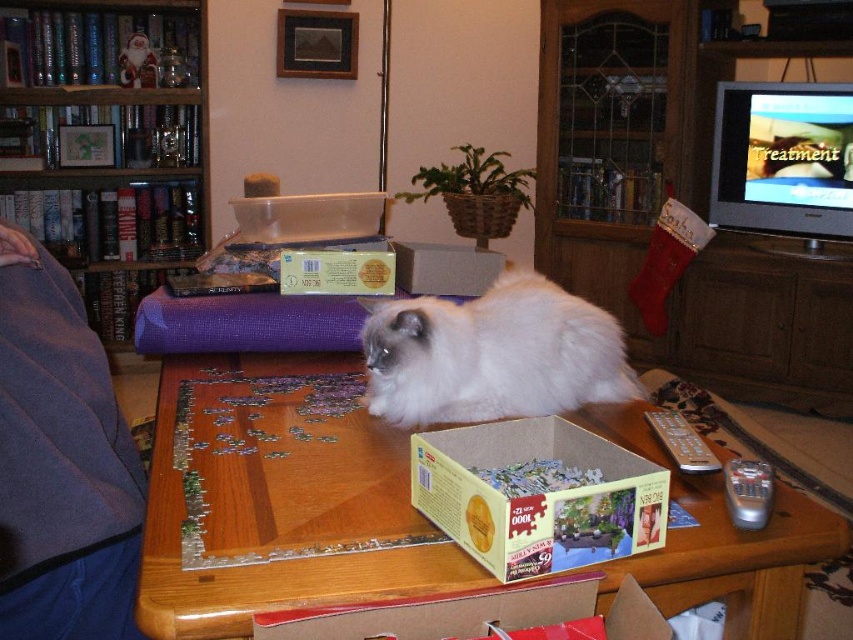
Question: Among these points, which one is nearest to the camera?

Choices:
 (A) (614, 541)
 (B) (274, 456)
 (C) (67, 148)

Answer: (A)

Question: Does wooden table at center appear on the left side of cardboard box at center?

Choices:
 (A) no
 (B) yes

Answer: (B)

Question: Which point is closer to the camera?

Choices:
 (A) wooden table at center
 (B) white fluffy cat at center
 (C) wooden bookshelf at upper left
 (D) cardboard puzzle box at center

Answer: (A)

Question: Where is wooden bookshelf at upper left located in relation to cardboard box at center in the image?

Choices:
 (A) right
 (B) left

Answer: (B)

Question: Is wooden bookshelf at upper left thinner than cardboard puzzle box at center?

Choices:
 (A) yes
 (B) no

Answer: (B)

Question: Which of these objects is positioned closest to the wooden puzzle pieces at center?

Choices:
 (A) wooden bookshelf at upper left
 (B) cardboard box at center
 (C) white fluffy cat at center

Answer: (C)